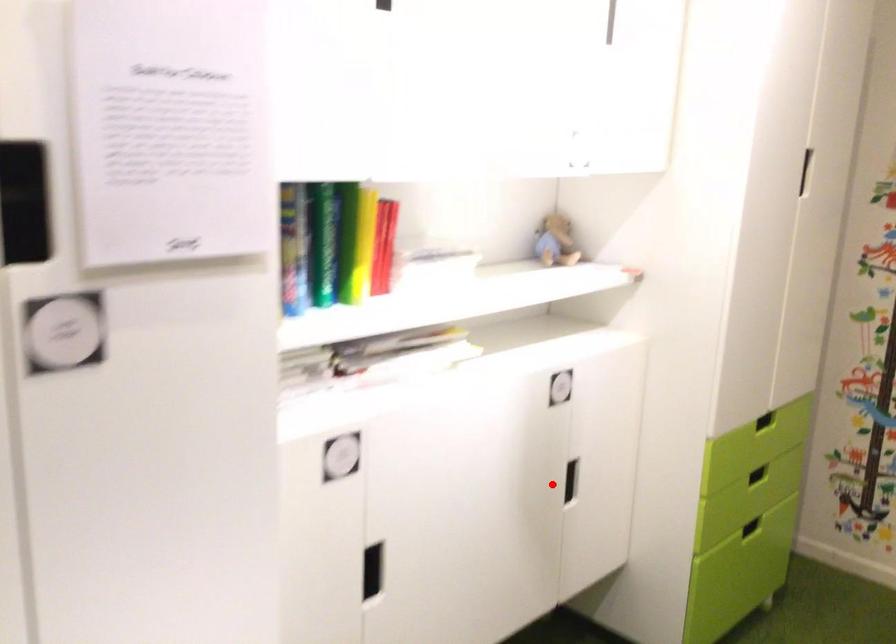
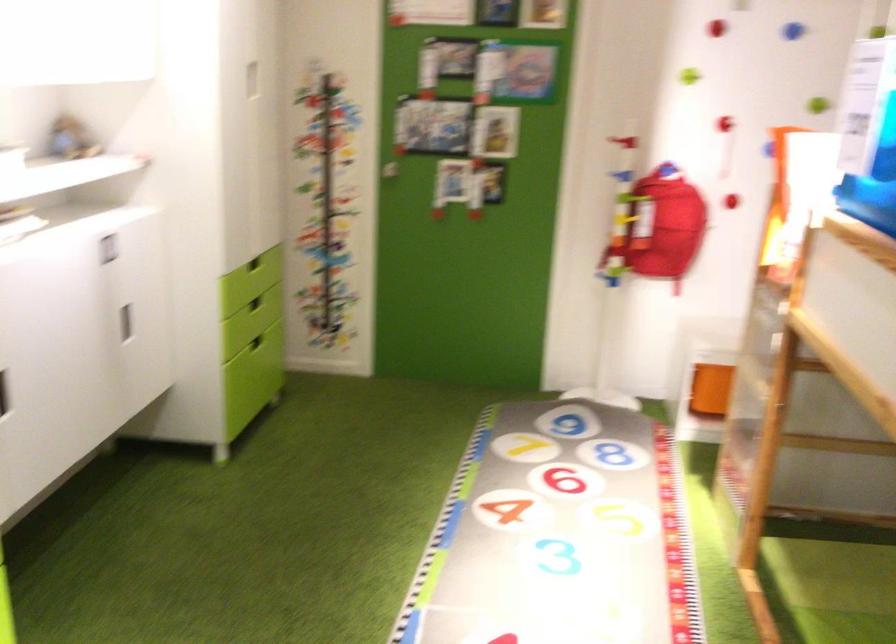
Question: A red point is marked in image1. In image2, is the corresponding 3D point closer to the camera or farther? Reply with the corresponding letter.

Choices:
 (A) The corresponding 3D point is closer.
 (B) The corresponding 3D point is farther.

Answer: (B)